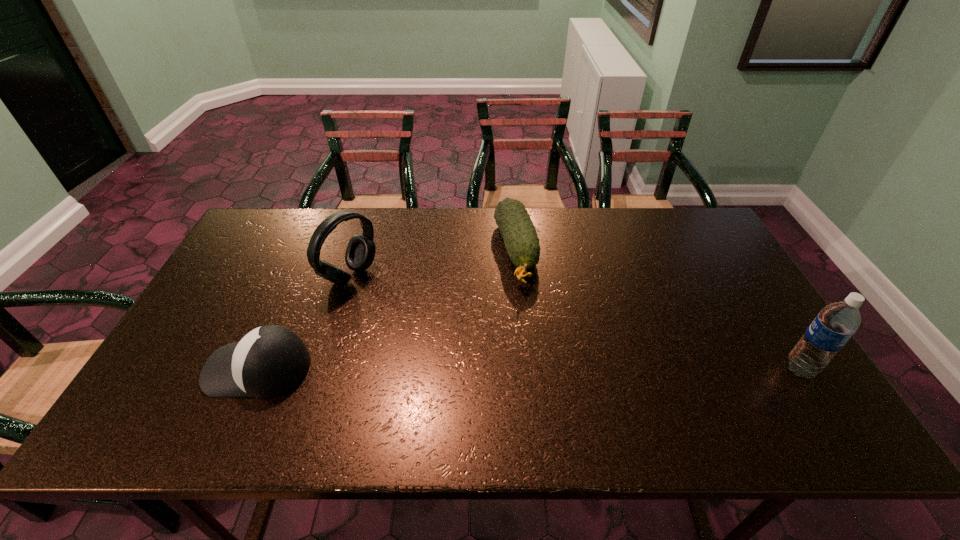
The width and height of the screenshot is (960, 540). What are the coordinates of `vacant space on the desktop that is between the cap and the water bottle and is positioned at the blossom end of the cucumber` in the screenshot? It's located at (550, 368).

What are the coordinates of `free space on the desktop that is between the cap and the rightmost object and is positioned on the earcups of the third shortest object` in the screenshot? It's located at (517, 368).